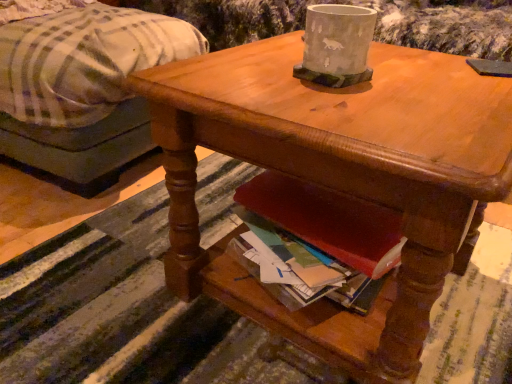
Question: Is wooden desk at center closer to camera compared to plaid fabric ottoman at left?

Choices:
 (A) no
 (B) yes

Answer: (B)

Question: From the image's perspective, is wooden desk at center on top of plaid fabric ottoman at left?

Choices:
 (A) no
 (B) yes

Answer: (A)

Question: Is wooden desk at center wider than plaid fabric ottoman at left?

Choices:
 (A) yes
 (B) no

Answer: (B)

Question: Is wooden desk at center with plaid fabric ottoman at left?

Choices:
 (A) yes
 (B) no

Answer: (B)

Question: Can you confirm if wooden desk at center is positioned to the right of plaid fabric ottoman at left?

Choices:
 (A) yes
 (B) no

Answer: (A)

Question: Choose the correct answer: Is plaid fabric ottoman at left inside wooden desk at center or outside it?

Choices:
 (A) inside
 (B) outside

Answer: (B)

Question: Is plaid fabric ottoman at left wider or thinner than wooden desk at center?

Choices:
 (A) wide
 (B) thin

Answer: (A)

Question: Considering the positions of plaid fabric ottoman at left and wooden desk at center in the image, is plaid fabric ottoman at left bigger or smaller than wooden desk at center?

Choices:
 (A) small
 (B) big

Answer: (B)

Question: Considering the positions of plaid fabric ottoman at left and wooden desk at center in the image, is plaid fabric ottoman at left taller or shorter than wooden desk at center?

Choices:
 (A) tall
 (B) short

Answer: (A)

Question: From the image's perspective, is gray concrete pot at upper center positioned above or below wooden desk at center?

Choices:
 (A) below
 (B) above

Answer: (B)

Question: Is point [x=350, y=82] closer or farther from the camera than point [x=455, y=132]?

Choices:
 (A) farther
 (B) closer

Answer: (A)

Question: Is gray concrete pot at upper center taller or shorter than wooden desk at center?

Choices:
 (A) tall
 (B) short

Answer: (B)

Question: In terms of size, does gray concrete pot at upper center appear bigger or smaller than wooden desk at center?

Choices:
 (A) big
 (B) small

Answer: (B)

Question: Considering the positions of wooden desk at center and gray concrete pot at upper center in the image, is wooden desk at center wider or thinner than gray concrete pot at upper center?

Choices:
 (A) thin
 (B) wide

Answer: (B)

Question: From the image's perspective, is wooden desk at center positioned above or below gray concrete pot at upper center?

Choices:
 (A) above
 (B) below

Answer: (B)